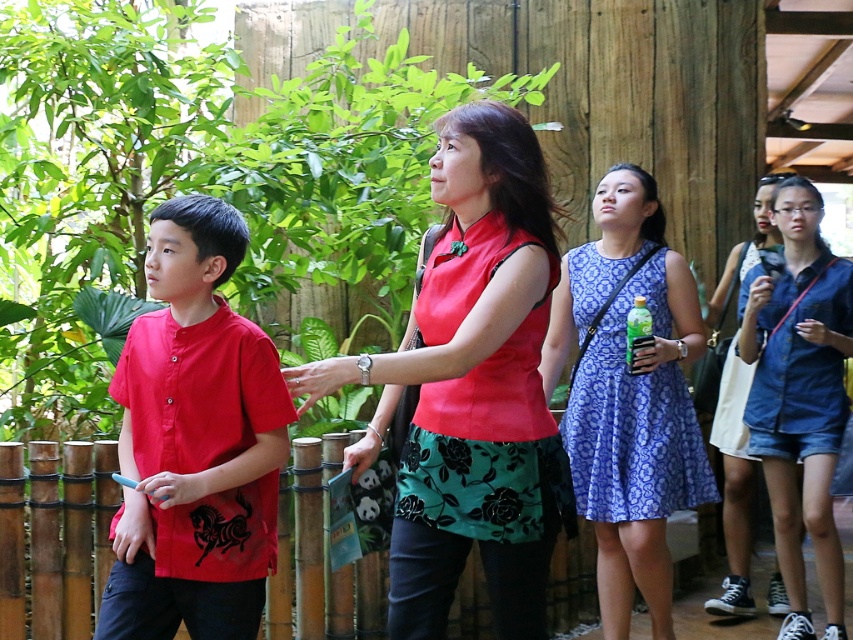
Is point (519, 579) closer to viewer compared to point (726, 284)?

Yes, point (519, 579) is in front of point (726, 284).

Between matte red blouse at center and denim shorts at lower right, which one has less height?

matte red blouse at center is shorter.

Measure the distance between matte red blouse at center and camera.

The distance of matte red blouse at center from camera is 9.69 feet.

Locate an element on the screen. This screenshot has height=640, width=853. matte red blouse at center is located at coordinates (471, 387).

How distant is matte red shirt at left from blue floral dress at center?

matte red shirt at left is 4.95 feet from blue floral dress at center.

Is matte red shirt at left further to the viewer compared to blue floral dress at center?

No.

Between point (137, 458) and point (669, 321), which one is positioned behind?

Positioned behind is point (669, 321).

This screenshot has width=853, height=640. Identify the location of matte red shirt at left. (195, 442).

Is point (625, 420) positioned after point (764, 186)?

No, it is not.

Does blue floral dress at center appear over denim shorts at lower right?

No, blue floral dress at center is not above denim shorts at lower right.

Is point (672, 467) closer to camera compared to point (759, 220)?

Yes, it is.

This screenshot has height=640, width=853. Identify the location of blue floral dress at center. (630, 397).